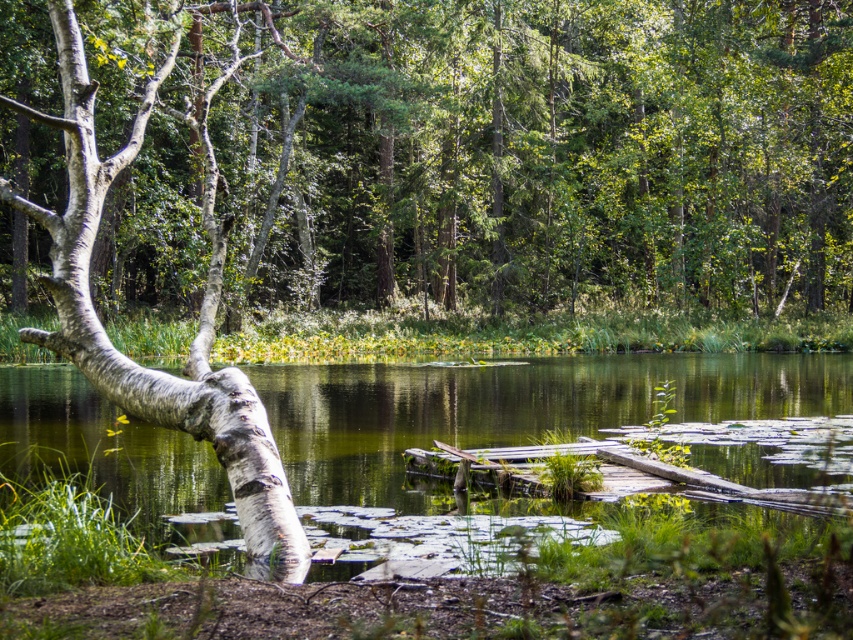
Question: Among these points, which one is farthest from the camera?

Choices:
 (A) (57, 419)
 (B) (279, 573)
 (C) (660, 145)
 (D) (200, 349)

Answer: (C)

Question: Which point is closer to the camera?

Choices:
 (A) (560, 403)
 (B) (289, 563)
 (C) (177, 266)
 (D) (212, 410)

Answer: (B)

Question: Based on their relative distances, which object is farther from the white bark tree at left?

Choices:
 (A) green mossy log at center
 (B) white textured bark at left
 (C) white bark tree trunk at left

Answer: (C)

Question: Is green mossy log at center bigger than white textured bark at left?

Choices:
 (A) no
 (B) yes

Answer: (A)

Question: Is green mossy log at center bigger than white bark tree trunk at left?

Choices:
 (A) no
 (B) yes

Answer: (B)

Question: Does green mossy log at center appear on the left side of white textured bark at left?

Choices:
 (A) no
 (B) yes

Answer: (A)